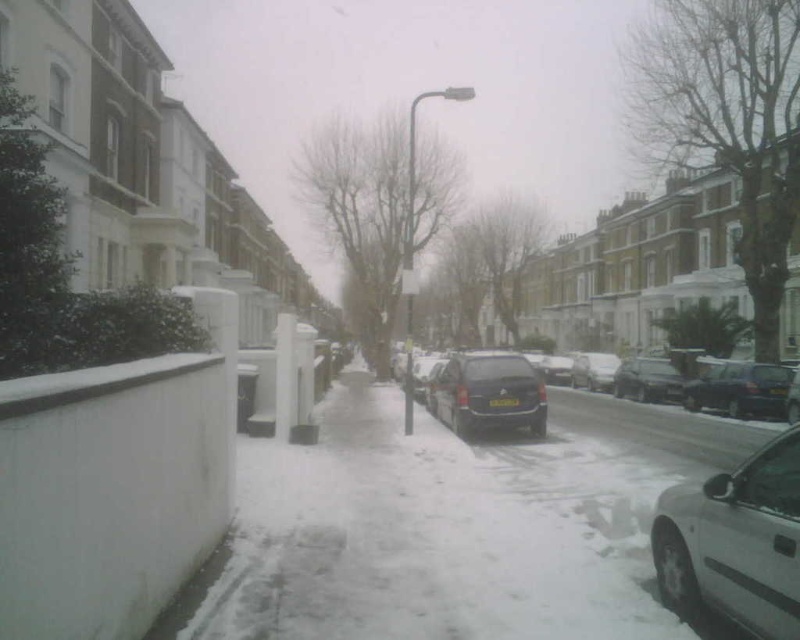
Question: Is white matte car at lower right below dark gray matte van at center?

Choices:
 (A) yes
 (B) no

Answer: (B)

Question: Among these points, which one is farthest from the camera?

Choices:
 (A) [x=674, y=566]
 (B) [x=760, y=400]
 (C) [x=658, y=356]

Answer: (C)

Question: Which point appears farthest from the camera in this image?

Choices:
 (A) (413, 609)
 (B) (514, 360)

Answer: (B)

Question: Can you confirm if dark gray matte van at center is positioned below matte black car at center?

Choices:
 (A) yes
 (B) no

Answer: (B)

Question: Does white snow-covered pavement at lower left have a smaller size compared to dark gray matte van at center?

Choices:
 (A) yes
 (B) no

Answer: (A)

Question: Which object is farther from the camera taking this photo?

Choices:
 (A) white snow-covered pavement at lower left
 (B) dark blue metallic car at right

Answer: (B)